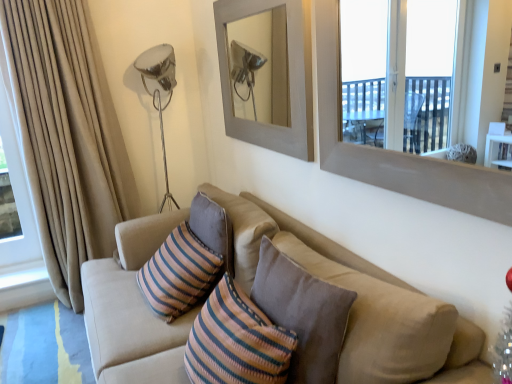
Question: Considering the positions of point (28, 84) and point (181, 220), is point (28, 84) closer or farther from the camera than point (181, 220)?

Choices:
 (A) closer
 (B) farther

Answer: (A)

Question: Do you think beige fabric curtain at left is within beige fabric couch at center, or outside of it?

Choices:
 (A) outside
 (B) inside

Answer: (A)

Question: Estimate the real-world distances between objects in this image. Which object is farther from the gray matte picture frame at upper center?

Choices:
 (A) beige fabric curtain at left
 (B) beige fabric couch at center
 (C) smooth gray window frame at upper right

Answer: (A)

Question: Which object is the closest to the smooth gray window frame at upper right?

Choices:
 (A) beige fabric couch at center
 (B) beige fabric curtain at left
 (C) gray matte picture frame at upper center

Answer: (A)